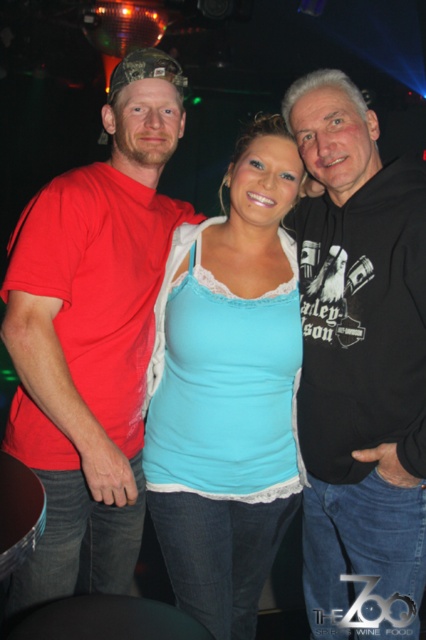
Question: Does black hoodie at right come in front of matte red t-shirt at left?

Choices:
 (A) no
 (B) yes

Answer: (A)

Question: Which of the following is the farthest from the observer?

Choices:
 (A) matte red t-shirt at left
 (B) black hoodie at right
 (C) light blue fabric tank top at center

Answer: (C)

Question: Which point is closer to the camera taking this photo?

Choices:
 (A) (118, 84)
 (B) (336, 499)

Answer: (A)

Question: Which point is closer to the camera?

Choices:
 (A) (402, 392)
 (B) (123, 68)

Answer: (A)

Question: Does black hoodie at right have a larger size compared to light blue fabric tank top at center?

Choices:
 (A) yes
 (B) no

Answer: (A)

Question: Does black hoodie at right appear on the right side of matte red t-shirt at left?

Choices:
 (A) yes
 (B) no

Answer: (A)